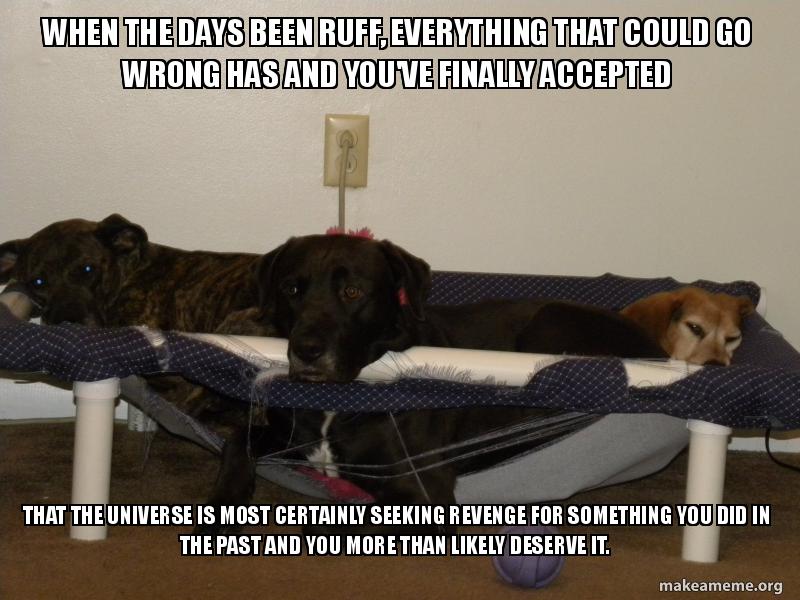
Where is `receptacle`? The width and height of the screenshot is (800, 600). receptacle is located at coordinates (362, 146).